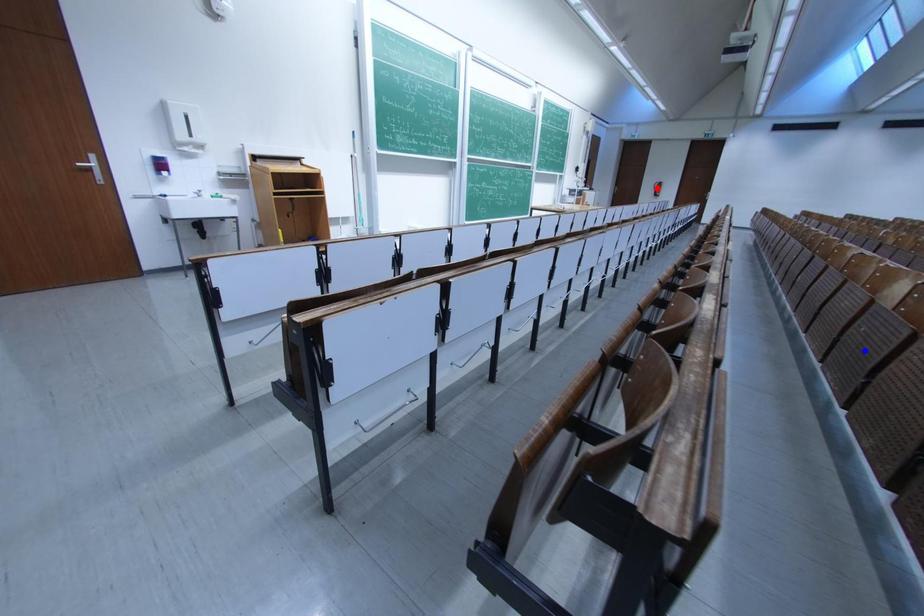
Question: In the image, two points are highlighted. Which point is nearer to the camera? Reply with the corresponding letter.

Choices:
 (A) blue point
 (B) red point

Answer: (A)